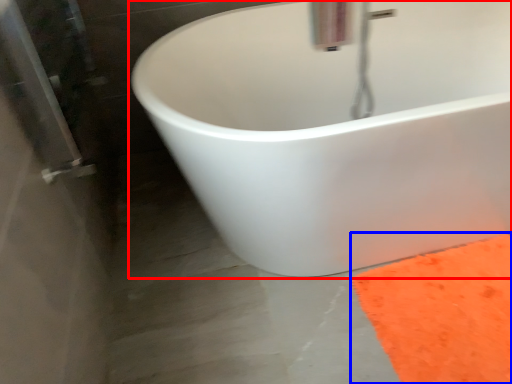
Question: Which point is further to the camera, bathtub (highlighted by a red box) or doormat (highlighted by a blue box)?

Choices:
 (A) bathtub
 (B) doormat

Answer: (B)